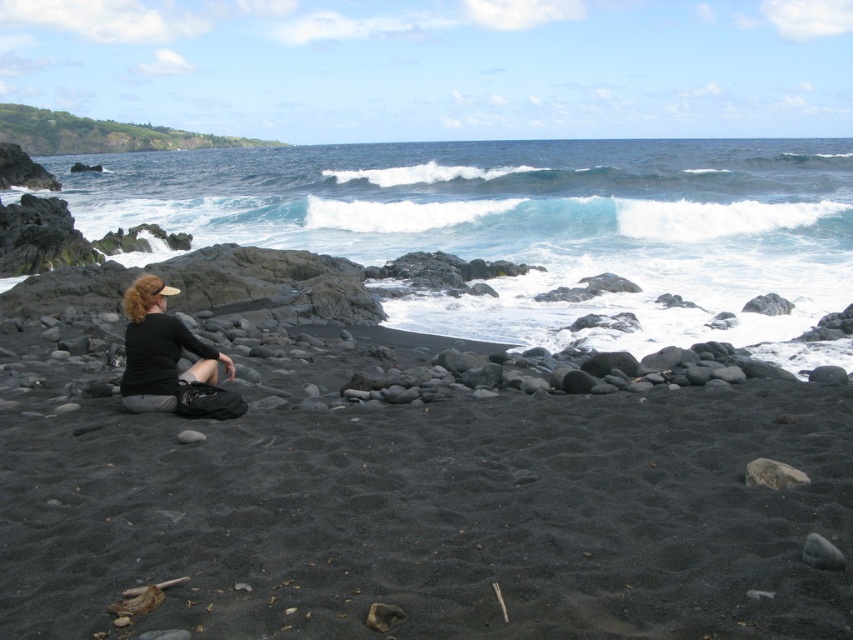
You are a photographer trying to capture a closeup of the smooth gray rock at center. However, the matte black shirt at center is blocking your view. Can you determine if the rock is visible behind the shirt?

The matte black shirt at center is taller than smooth gray rock at center, so the shirt is blocking the view of the rock.